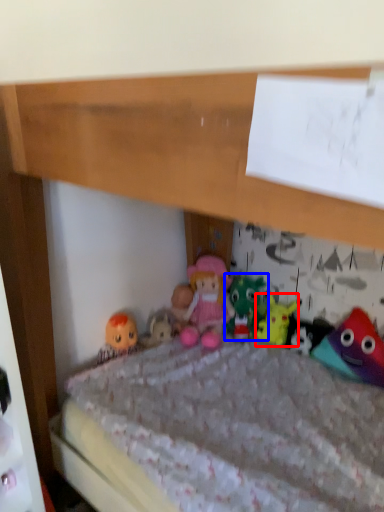
Question: Which point is closer to the camera, toy (highlighted by a red box) or toy (highlighted by a blue box)?

Choices:
 (A) toy
 (B) toy

Answer: (A)